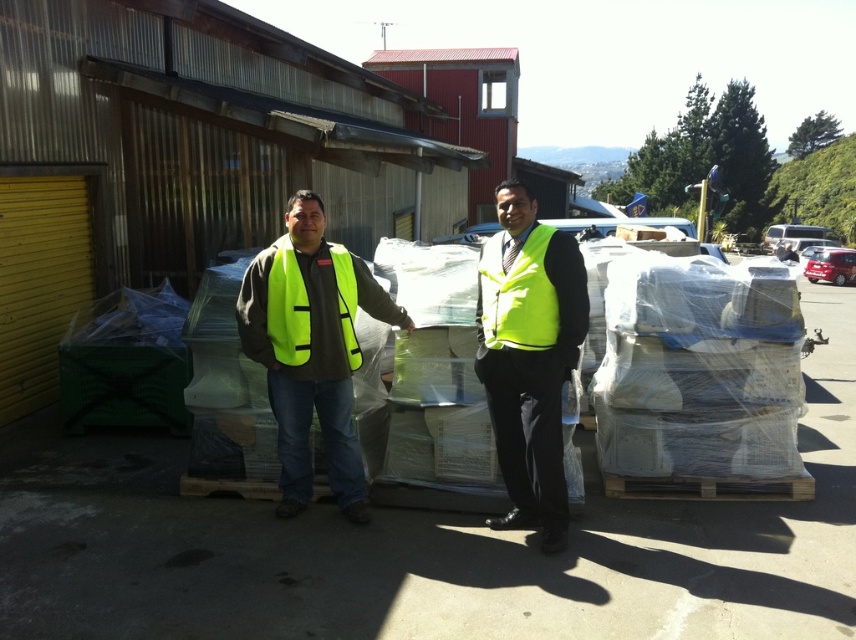
Question: From the image, what is the correct spatial relationship of high visibility yellow vest at center in relation to yellow high-visibility vest at center?

Choices:
 (A) above
 (B) below

Answer: (B)

Question: Estimate the real-world distances between objects in this image. Which object is farther from the yellow high-visibility vest at center?

Choices:
 (A) neon yellow vest at center
 (B) yellow reflective safety vest at center

Answer: (A)

Question: Which is nearer to the yellow reflective safety vest at center?

Choices:
 (A) neon yellow vest at center
 (B) high visibility yellow vest at center
 (C) yellow high-visibility vest at center

Answer: (A)

Question: Considering the relative positions of high visibility yellow vest at center and yellow high-visibility vest at center in the image provided, where is high visibility yellow vest at center located with respect to yellow high-visibility vest at center?

Choices:
 (A) above
 (B) below

Answer: (B)

Question: Which point is closer to the camera?

Choices:
 (A) high visibility yellow vest at center
 (B) yellow high-visibility vest at center
 (C) neon yellow vest at center

Answer: (C)

Question: Is neon yellow vest at center above yellow high-visibility vest at center?

Choices:
 (A) yes
 (B) no

Answer: (B)